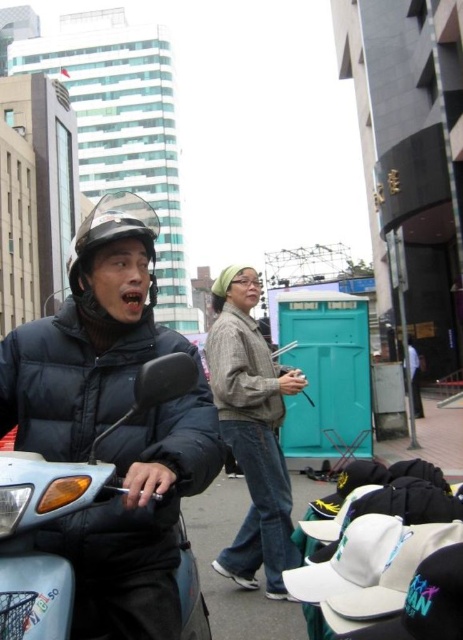
You are a delivery rider who needs to park your scooter between the light blue plastic motorcycle at left and the knitted beige sweater at center. Given that your scooter is 1.2 meters wide, is there enough space between them?

The light blue plastic motorcycle at left is to the left of the knitted beige sweater at center. Since the distance between them isn not specified, but the scooter is 1.2 meters wide, we cannot confirm if there is enough space without knowing the exact distance between the two objects.

You are a delivery person needing to place a 1.5 meter long package between the knitted beige sweater at center and the matte black helmet at center. Is there enough space?

The knitted beige sweater at center is 1.54 meters from the matte black helmet at center. Since the package is 1.5 meters long, there is enough space to place it between them.